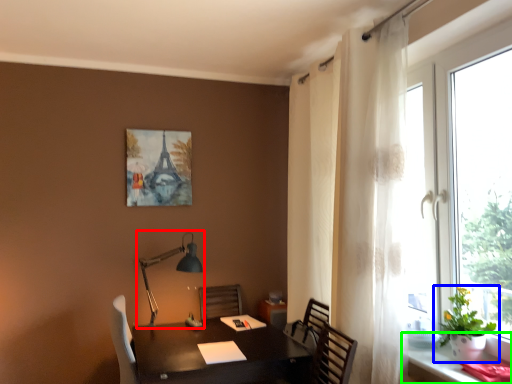
Question: Considering the real-world distances, which object is closest to table lamp (highlighted by a red box)? houseplant (highlighted by a blue box) or computer desk (highlighted by a green box).

Choices:
 (A) houseplant
 (B) computer desk

Answer: (B)